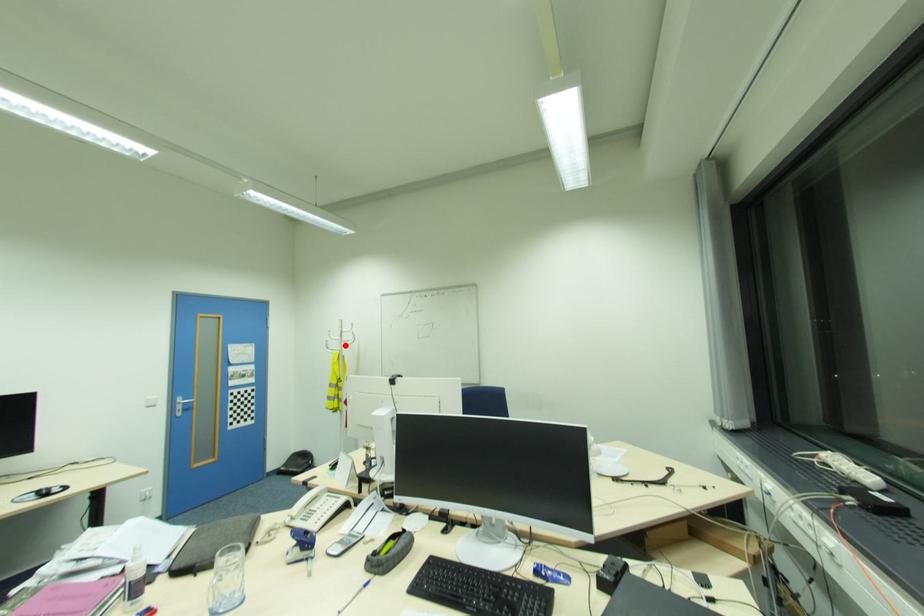
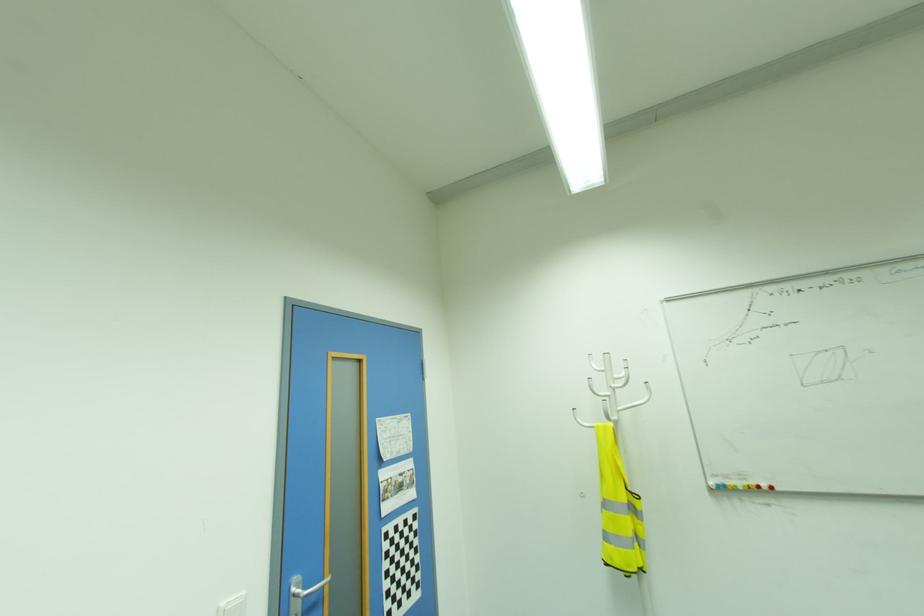
Where in the second image is the point corresponding to the highlighted location from the first image?

(622, 408)